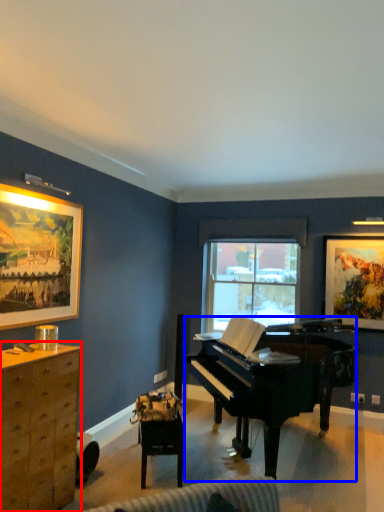
Question: Among these objects, which one is nearest to the camera, cabinetry (highlighted by a red box) or piano (highlighted by a blue box)?

Choices:
 (A) cabinetry
 (B) piano

Answer: (A)